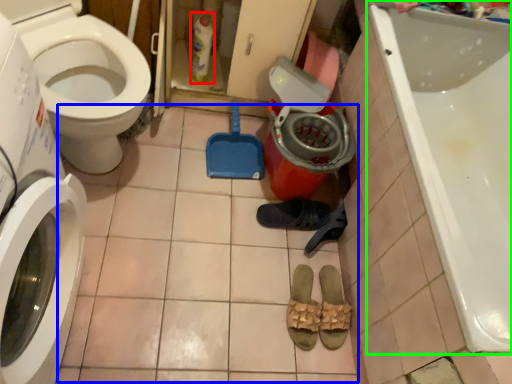
Question: Considering the real-world distances, which object is closest to cleaning product (highlighted by a red box)? tile (highlighted by a blue box) or bathtub (highlighted by a green box).

Choices:
 (A) tile
 (B) bathtub

Answer: (A)